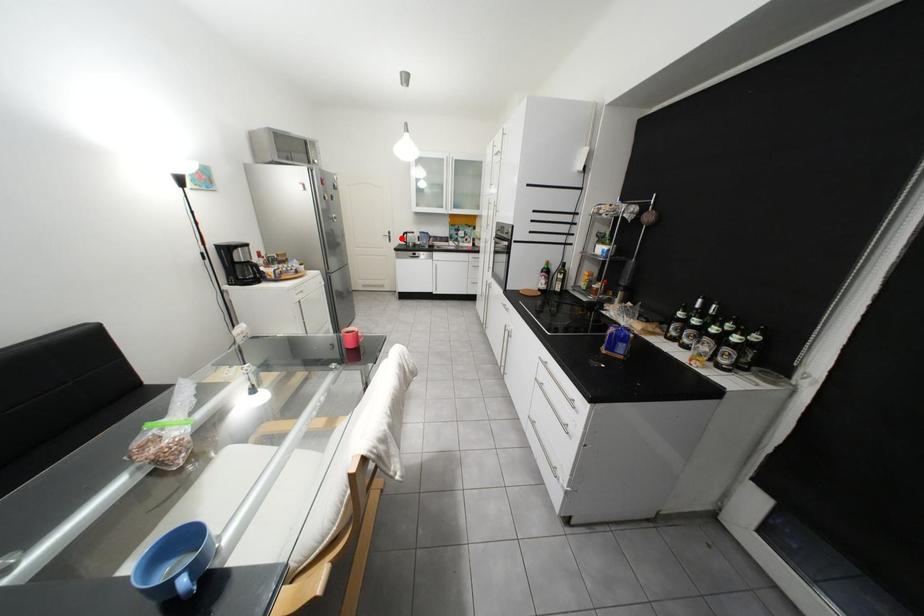
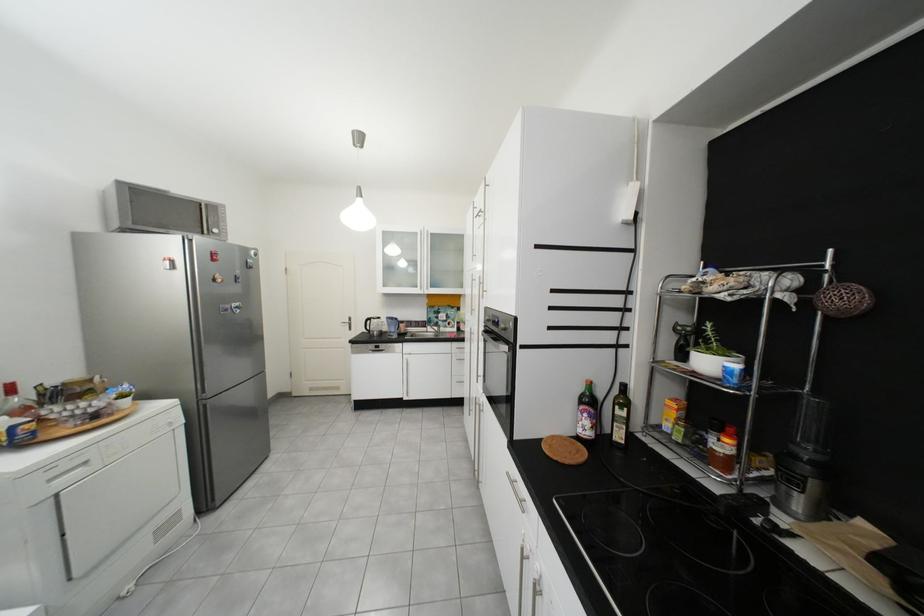
Question: A red point is marked in image1. In image2, is the corresponding 3D point closer to the camera or farther? Reply with the corresponding letter.

Choices:
 (A) The corresponding 3D point is closer.
 (B) The corresponding 3D point is farther.

Answer: (B)